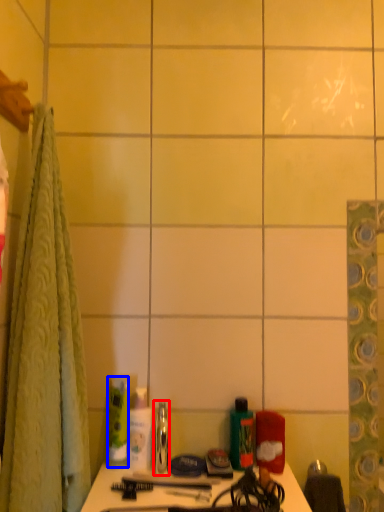
Question: Among these objects, which one is nearest to the camera, mouthwash (highlighted by a red box) or toiletry (highlighted by a blue box)?

Choices:
 (A) mouthwash
 (B) toiletry

Answer: (A)